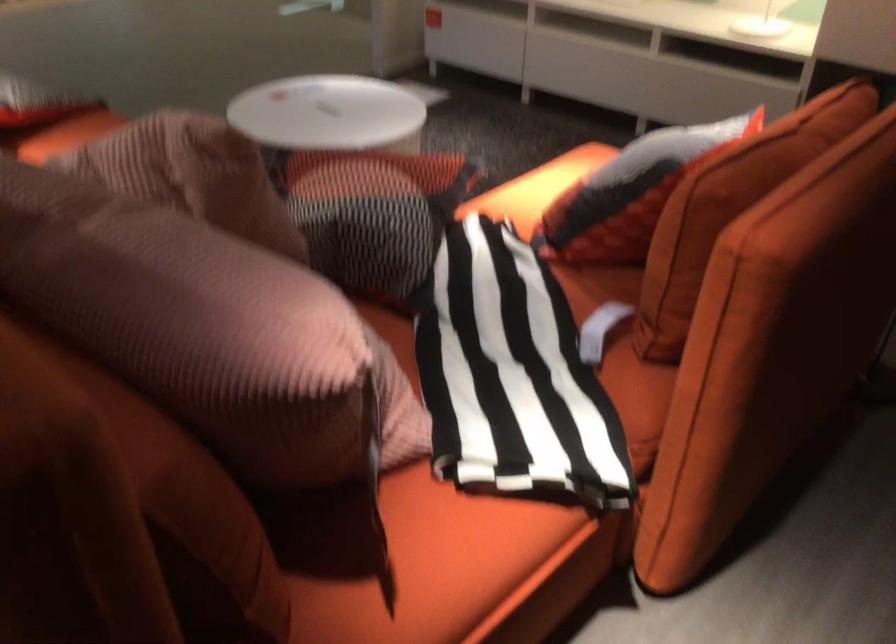
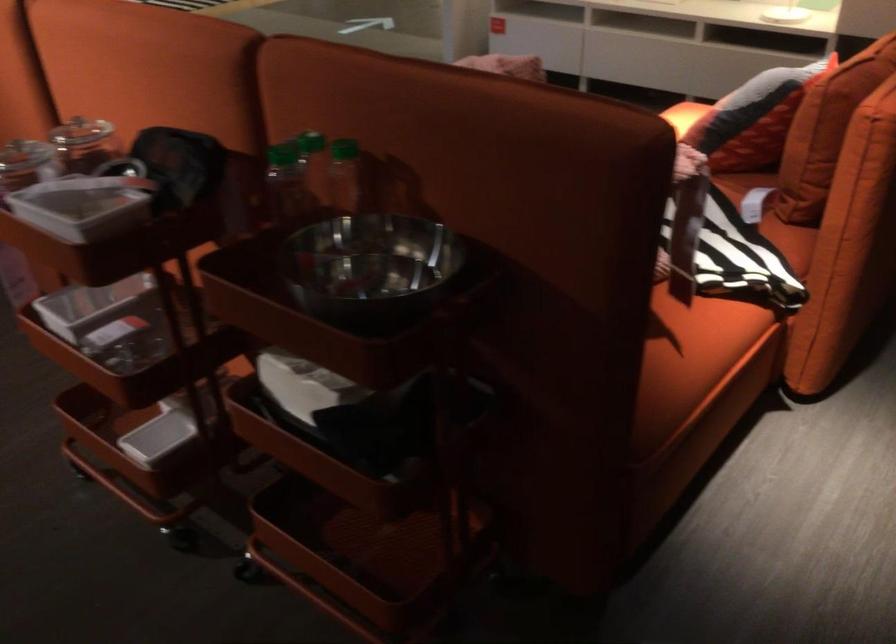
In a continuous first-person perspective shot, in which direction is the camera moving?

The cameraman moved toward left, backward.